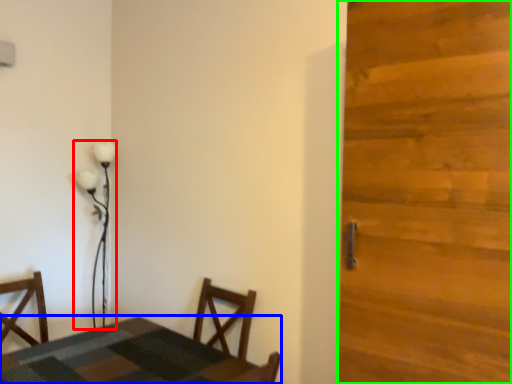
Question: Considering the real-world distances, which object is closest to lamp (highlighted by a red box)? table (highlighted by a blue box) or door (highlighted by a green box).

Choices:
 (A) table
 (B) door

Answer: (A)